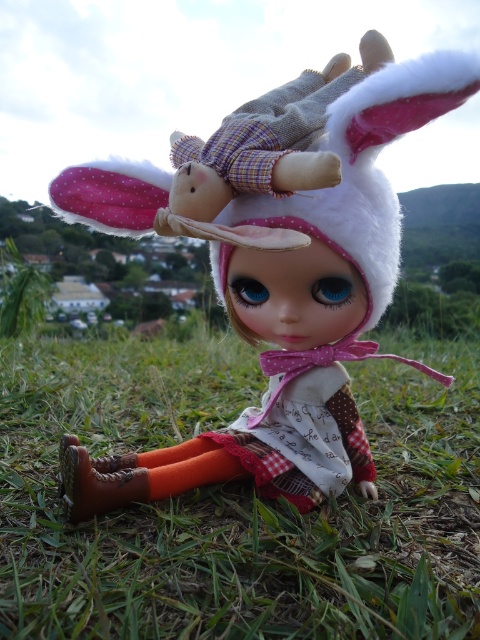
You are standing in front of the doll on the grassy hillside. You notice two points marked on the image. Which point, point 1 at coordinates (288, 572) or point 2 at (357, 449), is closer to you?

Point 1 at coordinates (288, 572) is closer to you than point 2 at (357, 449).

You are planning to place a small flowerpot between the green grass at center and the matte fabric doll at center. Considering their widths, which object should the flowerpot be placed closer to?

The green grass at center is wider than the matte fabric doll at center, so the flowerpot should be placed closer to the matte fabric doll at center to balance the space.

You are a photographer trying to capture the matte fabric doll at center and the green grass at center in a single shot. Based on their positions, which object should you focus on first if you want to ensure both are in frame?

The green grass at center is positioned on the left side of matte fabric doll at center. Since both objects are at the center but the grass is slightly to the left, you should focus on the matte fabric doll at center first as it is the main subject and ensure the green grass at center is visible to the left.